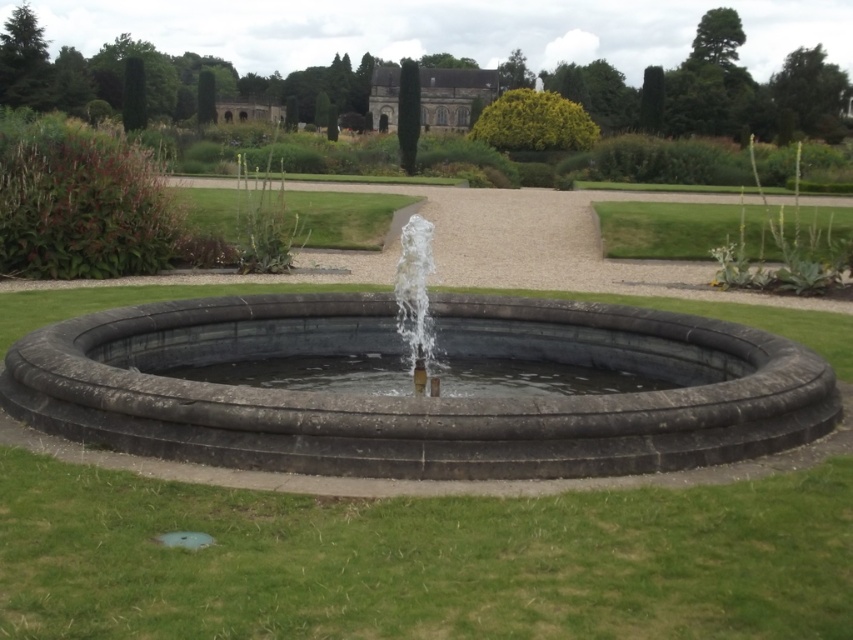
Question: In this image, where is dark gray stone fountain at center located relative to clear stone water at center?

Choices:
 (A) right
 (B) left

Answer: (B)

Question: Which object appears closest to the camera in this image?

Choices:
 (A) clear stone water at center
 (B) dark gray stone fountain at center

Answer: (B)

Question: Can you confirm if dark gray stone fountain at center is positioned to the left of clear stone water at center?

Choices:
 (A) yes
 (B) no

Answer: (A)

Question: Does dark gray stone fountain at center appear over clear stone water at center?

Choices:
 (A) no
 (B) yes

Answer: (B)